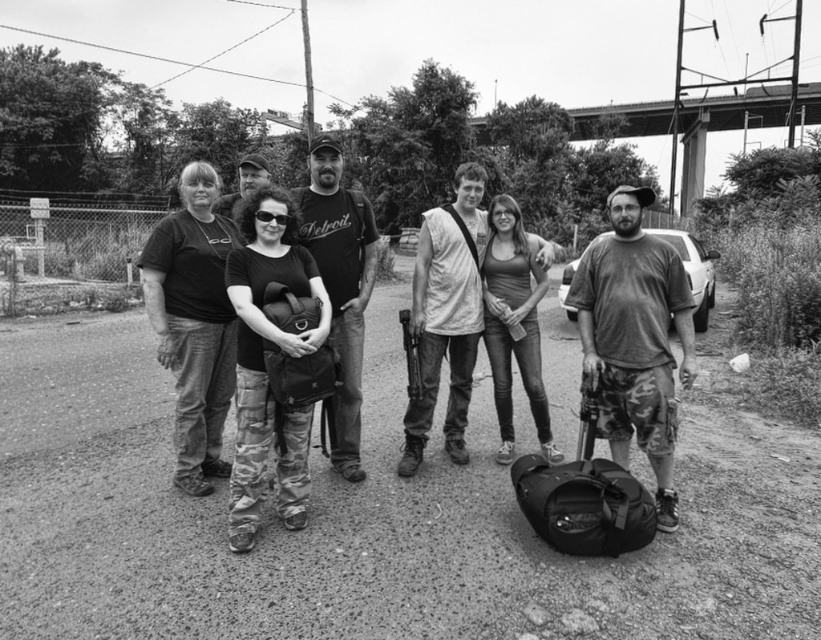
Can you confirm if camo pants at center is bigger than bearded man at center?

No, camo pants at center is not bigger than bearded man at center.

Does point (251, 499) lie in front of point (250, 156)?

Yes, point (251, 499) is closer to viewer.

Does point (278, 403) come closer to viewer compared to point (221, 205)?

Yes.

Where is `camo pants at center`? Image resolution: width=821 pixels, height=640 pixels. camo pants at center is located at coordinates (274, 362).

Is dirt track at center below matte black t-shirt at center?

Correct, dirt track at center is located below matte black t-shirt at center.

Can you confirm if dirt track at center is thinner than matte black t-shirt at center?

Indeed, dirt track at center has a lesser width compared to matte black t-shirt at center.

Measure the distance between dirt track at center and camera.

dirt track at center is 15.81 feet from camera.

Image resolution: width=821 pixels, height=640 pixels. Identify the location of dirt track at center. (372, 522).

Is dirty camouflage shorts at center further to camera compared to light gray cotton shirt at center?

No, it is not.

Is dirty camouflage shorts at center closer to camera compared to light gray cotton shirt at center?

Yes, dirty camouflage shorts at center is closer to the viewer.

Which is behind, point (634, 202) or point (475, 243)?

Point (475, 243)

Where is `dirty camouflage shorts at center`? dirty camouflage shorts at center is located at coordinates (634, 339).